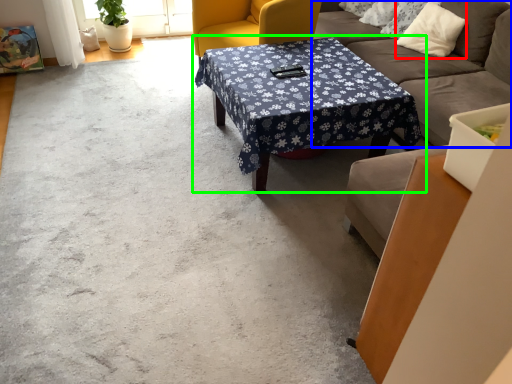
Question: Which object is positioned closest to pillow (highlighted by a red box)? Select from studio couch (highlighted by a blue box) and coffee table (highlighted by a green box).

Choices:
 (A) studio couch
 (B) coffee table

Answer: (A)